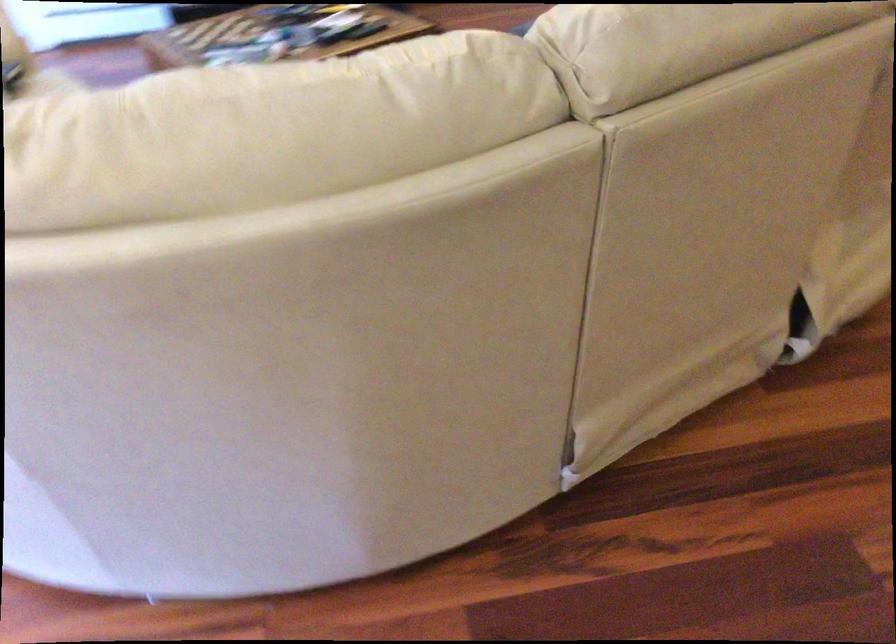
Where would you resting arm the sofa armrest? Please return your answer as a coordinate pair (x, y).

(362, 109)